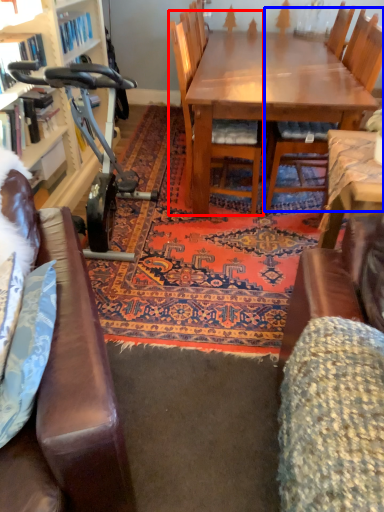
Question: Which object appears closest to the camera in this image, chair (highlighted by a red box) or chair (highlighted by a blue box)?

Choices:
 (A) chair
 (B) chair

Answer: (A)